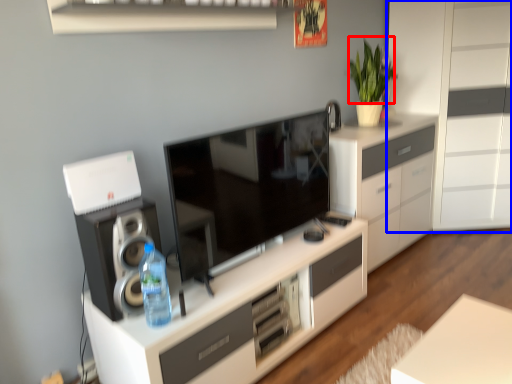
Question: Which point is closer to the camera, plant (highlighted by a red box) or chest of drawers (highlighted by a blue box)?

Choices:
 (A) plant
 (B) chest of drawers

Answer: (B)